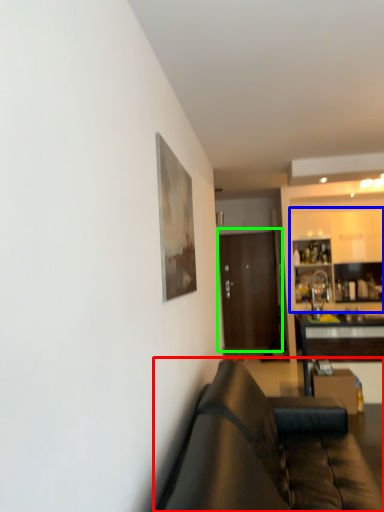
Question: Which object is positioned farthest from studio couch (highlighted by a red box)? Select from cabinetry (highlighted by a blue box) and door (highlighted by a green box).

Choices:
 (A) cabinetry
 (B) door

Answer: (B)